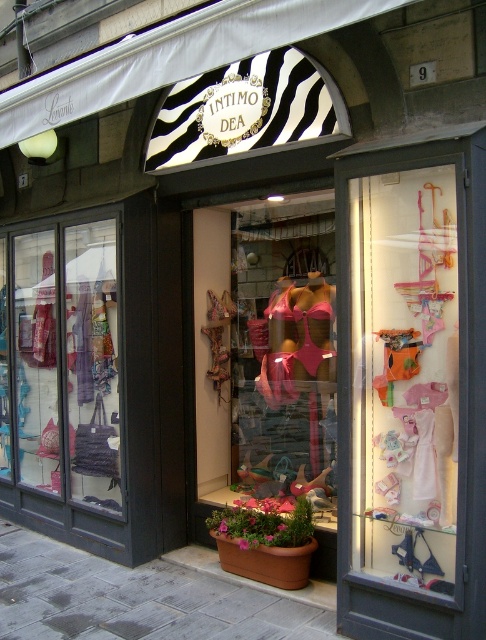
You are a customer entering the lingerie shop and notice the matte black bag at left and the gray concrete pavement at lower center. Which object is higher in height?

The matte black bag at left is taller than the gray concrete pavement at lower center.

You are a delivery person with a matte black bag at left that needs to be placed on the gray concrete pavement at lower center. Can you place it there without moving any other objects?

The matte black bag at left and gray concrete pavement at lower center are 1.17 meters apart, so yes, you can place the matte black bag at left on the gray concrete pavement at lower center without needing to move other objects as there is sufficient space between them.